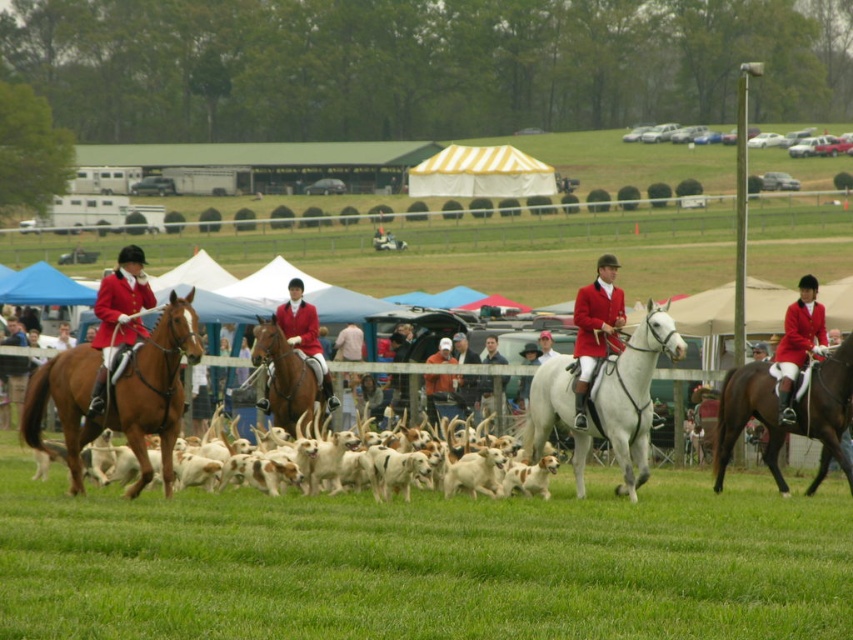
Which is above, shiny brown horse at center or matte red jacket at center?

matte red jacket at center

Does shiny brown horse at center have a smaller size compared to matte red jacket at center?

Yes, shiny brown horse at center is smaller than matte red jacket at center.

Identify the location of shiny brown horse at center. Image resolution: width=853 pixels, height=640 pixels. (285, 378).

Based on the photo, is white glossy horse at center wider than white fur dogs at center?

No, white glossy horse at center is not wider than white fur dogs at center.

In the scene shown: Does white glossy horse at center have a greater height compared to white fur dogs at center?

Correct, white glossy horse at center is much taller as white fur dogs at center.

Does point (553, 401) come behind point (236, 460)?

No, (553, 401) is closer to viewer.

In order to click on white glossy horse at center in this screenshot , I will do `click(605, 401)`.

Is shiny brown horse at left wider than matte red jacket at left?

No.

Does shiny brown horse at left appear on the right side of matte red jacket at left?

Yes, shiny brown horse at left is to the right of matte red jacket at left.

Who is more forward, (76, 444) or (141, 276)?

Point (76, 444) is more forward.

Locate an element on the screen. shiny brown horse at left is located at coordinates (119, 396).